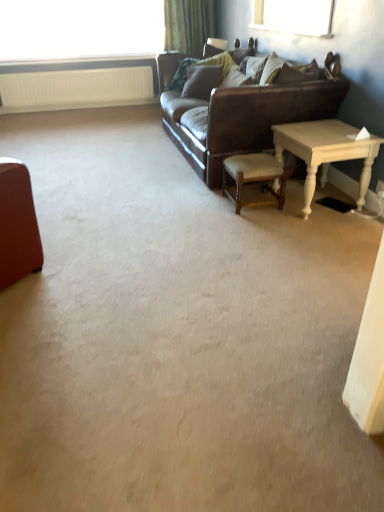
I want to click on free space in front of leather couch at center, so click(x=182, y=231).